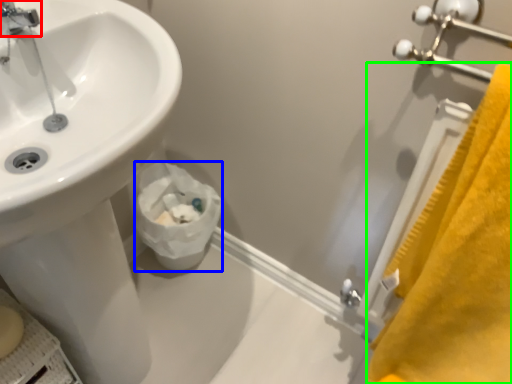
Question: Which is farther away from tap (highlighted by a red box)? toilet paper (highlighted by a blue box) or bath towel (highlighted by a green box)?

Choices:
 (A) toilet paper
 (B) bath towel

Answer: (B)